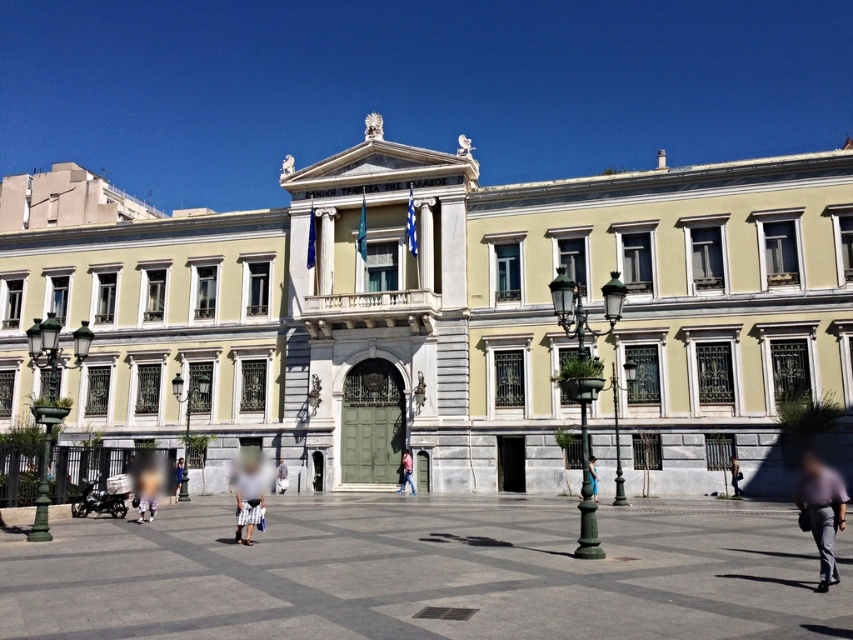
Question: Which point is closer to the camera?

Choices:
 (A) (277, 467)
 (B) (177, 488)

Answer: (B)

Question: Which point is closer to the camera?

Choices:
 (A) (419, 609)
 (B) (285, 465)
 (C) (238, 465)
 (D) (717, 401)

Answer: (A)

Question: Is light blue jeans at lower right behind denim skirt at center?

Choices:
 (A) no
 (B) yes

Answer: (A)

Question: Does smooth stone pavement at center have a smaller size compared to metallic grate at center?

Choices:
 (A) yes
 (B) no

Answer: (B)

Question: Among these points, which one is farthest from the camera?

Choices:
 (A) (236, 483)
 (B) (181, 468)
 (C) (279, 465)
 (D) (607, 528)

Answer: (C)

Question: Where is light yellow stone building at center located in relation to pink fabric pants at center in the image?

Choices:
 (A) below
 (B) above

Answer: (B)